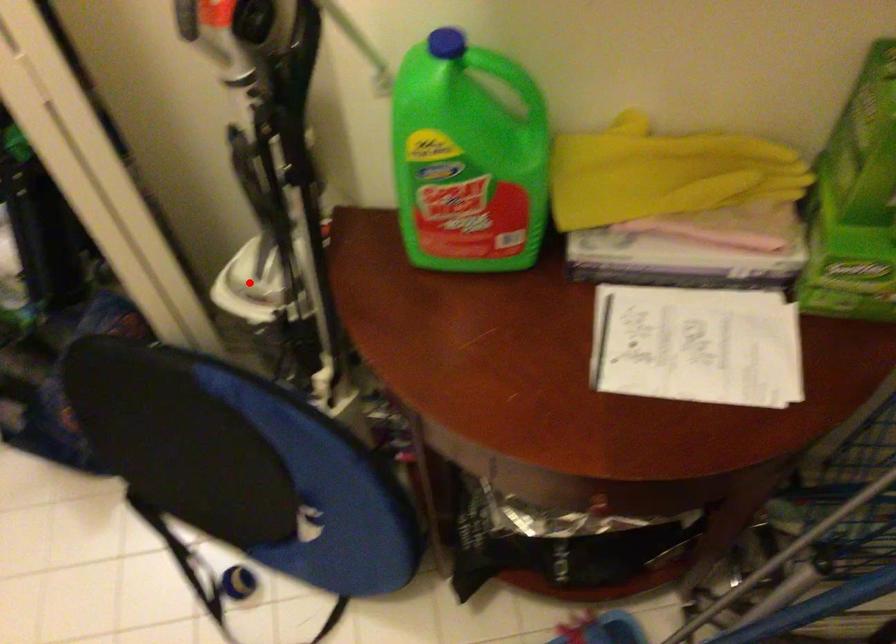
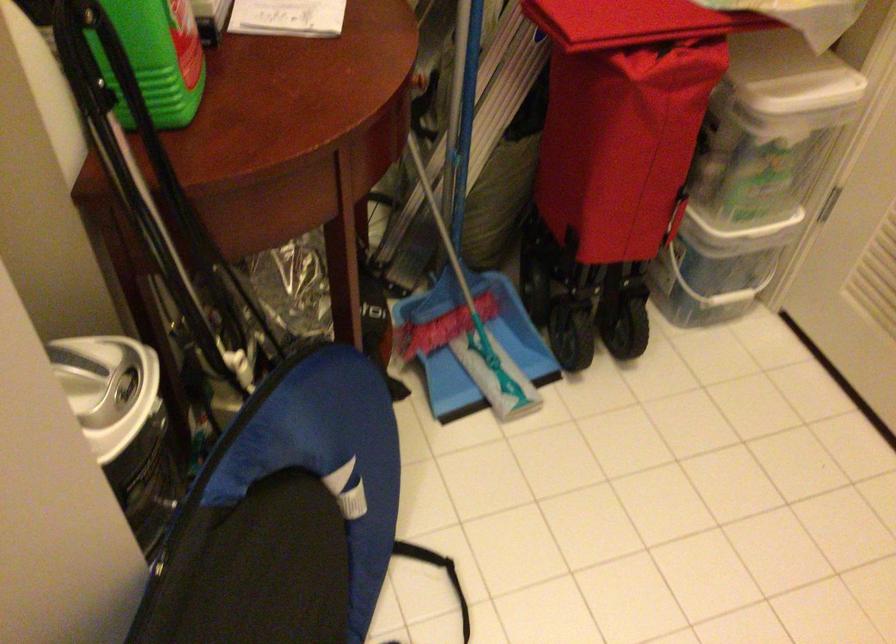
Find the pixel in the second image that matches the highlighted location in the first image.

(107, 388)